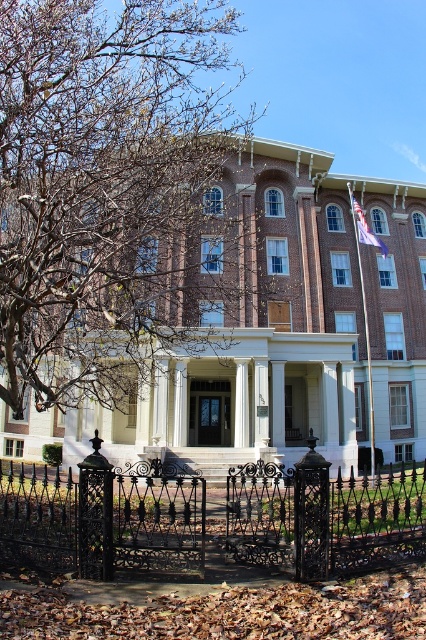
You are a visitor approaching the building and want to know if the brown leafy tree at upper left is taller than the black wrought iron gate at lower center. Can you confirm this?

The brown leafy tree at upper left has a greater height compared to the black wrought iron gate at lower center, so yes, the tree is taller than the gate.

You are standing in front of the building and looking at the entrance. Which object is positioned to the left of the other between the brown leafy tree at upper left and the white fabric flag at upper right?

The brown leafy tree at upper left is positioned to the left of the white fabric flag at upper right.

You are a visitor approaching the building and want to enter through the entrance. You see the brown leafy tree at upper left and the black wrought iron gate at lower center. Which object is closer to the entrance?

The black wrought iron gate at lower center is closer to the entrance because it is behind the brown leafy tree at upper left, indicating it is positioned nearer to the entrance area.